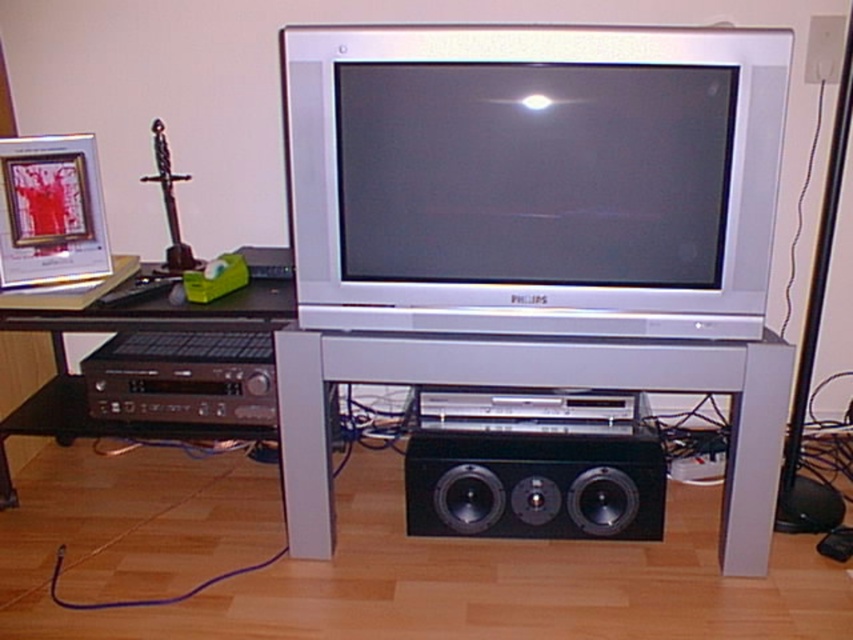
You are setting up a new lamp on the metallic silver table at center and need to place it so it doesn t block the black plastic stereo at lower left. Since the stereo is lower, where should you position the lamp?

Since the metallic silver table at center is taller than the black plastic stereo at lower left, placing the lamp on the higher surface of the metallic silver table at center will ensure it doesn t block the stereo below.